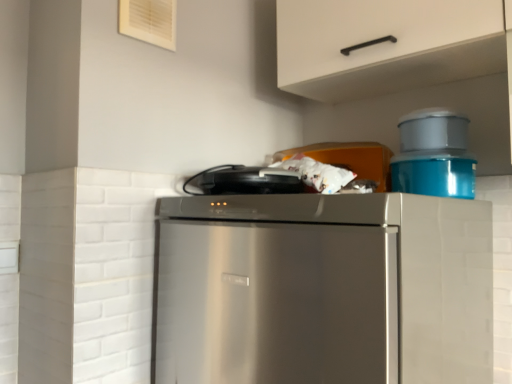
Question: In terms of width, does stainless steel refrigerator at center look wider or thinner when compared to white matte cabinet handle at upper center?

Choices:
 (A) wide
 (B) thin

Answer: (A)

Question: Is stainless steel refrigerator at center inside or outside of white matte cabinet handle at upper center?

Choices:
 (A) inside
 (B) outside

Answer: (B)

Question: Which is farther from the black matte toaster at upper center, acting as the first appliance starting from the left?

Choices:
 (A) stainless steel refrigerator at center
 (B) white matte cabinet handle at upper center
 (C) blue plastic container at upper right, the first appliance from the right
 (D) matte plastic container at upper right, placed as the 2th appliance when sorted from left to right

Answer: (B)

Question: Which object is positioned closest to the matte plastic container at upper right, which appears as the second appliance when viewed from the right?

Choices:
 (A) blue plastic container at upper right, the third appliance from the left
 (B) white matte cabinet handle at upper center
 (C) black matte toaster at upper center, the 3th appliance when ordered from right to left
 (D) stainless steel refrigerator at center

Answer: (A)